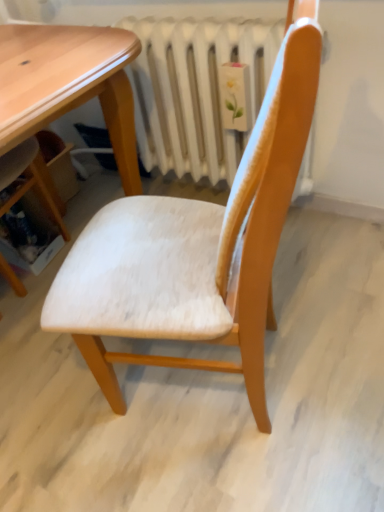
Find the location of a particular element. vacant space underneath white fabric chair at center (from a real-world perspective) is located at coordinates (195, 395).